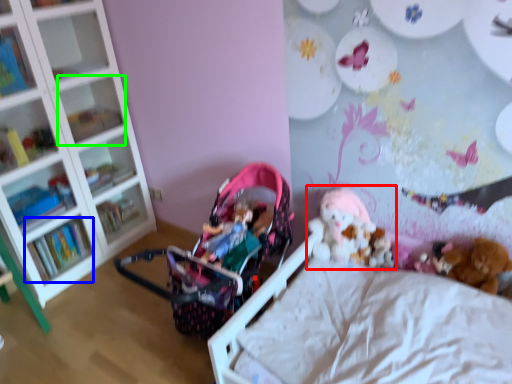
Question: Which object is positioned closest to toy (highlighted by a red box)? Select from book (highlighted by a blue box) and shelf (highlighted by a green box).

Choices:
 (A) book
 (B) shelf

Answer: (B)